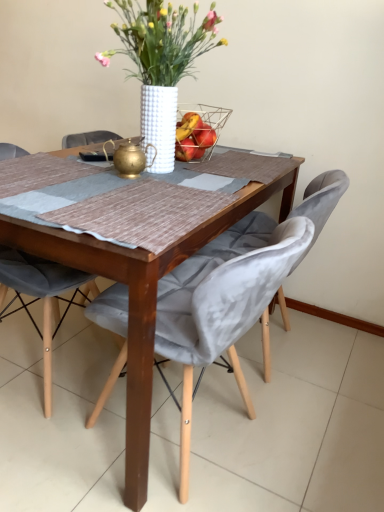
Locate an element on the screen. This screenshot has height=512, width=384. free space that is to the left of gold metallic teapot at center is located at coordinates (71, 178).